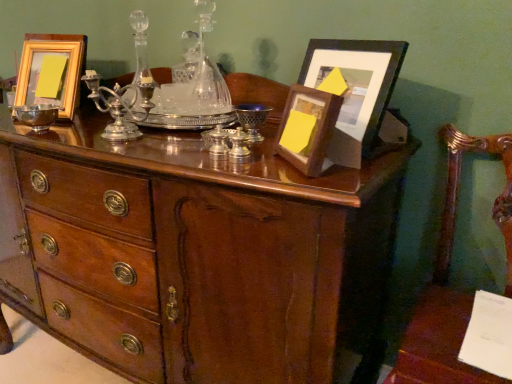
You are a GUI agent. You are given a task and a screenshot of the screen. Output one action in this format:
    pyautogui.click(x=<x>, y=<y>)
    Task: Click on the empty space that is to the right of silver polished candle holder at center, acting as the 3th candle holder starting from the right
    The image size is (512, 384).
    Given the screenshot: What is the action you would take?
    pyautogui.click(x=176, y=140)